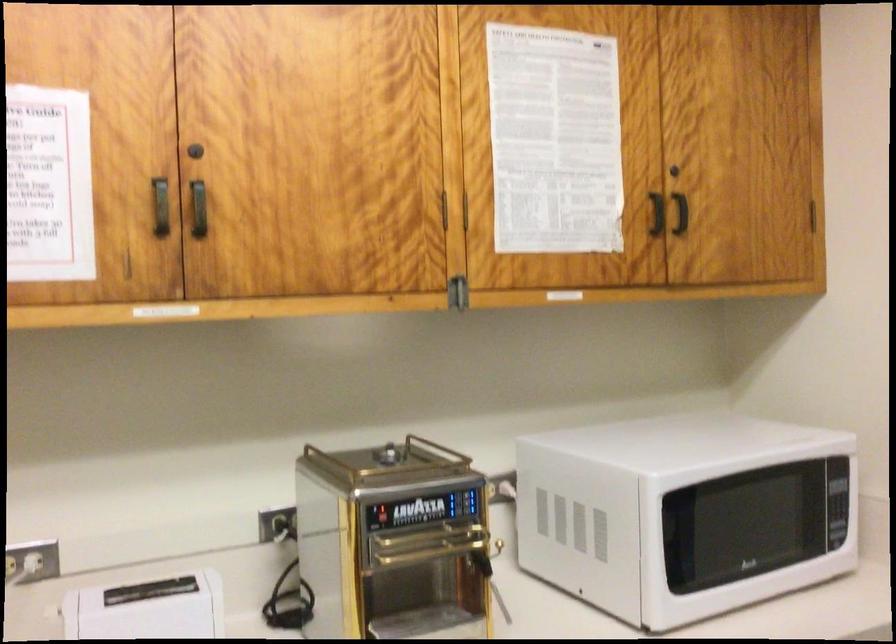
You are a GUI agent. You are given a task and a screenshot of the screen. Output one action in this format:
    pyautogui.click(x=<x>, y=<y>)
    Task: Click on the espresso machine knob
    The width and height of the screenshot is (896, 644).
    Given the screenshot: What is the action you would take?
    pyautogui.click(x=383, y=456)